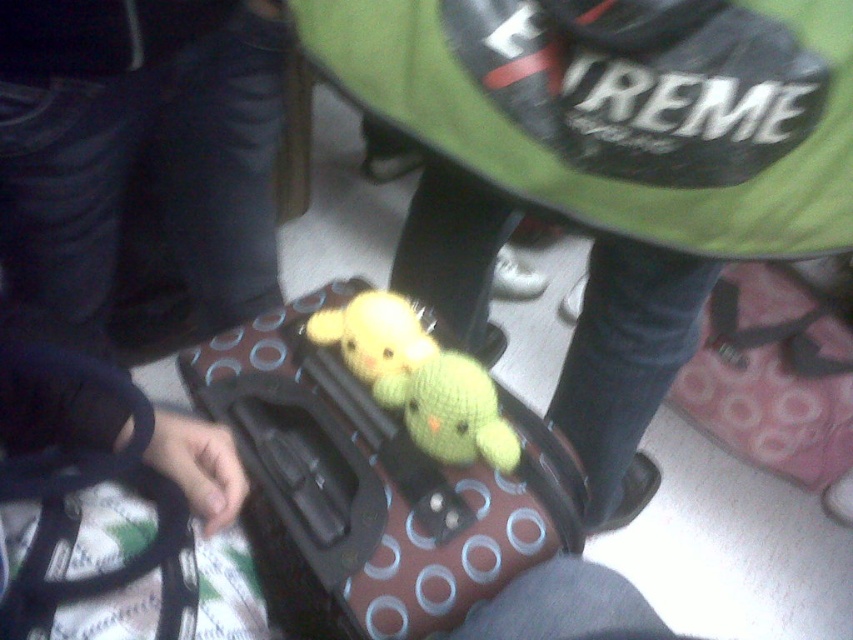
Can you confirm if brown polka dot suitcase at center is positioned to the left of yellow knitted toy at center?

Correct, you'll find brown polka dot suitcase at center to the left of yellow knitted toy at center.

Can you confirm if brown polka dot suitcase at center is positioned to the right of yellow knitted toy at center?

In fact, brown polka dot suitcase at center is to the left of yellow knitted toy at center.

Does point (289, 516) come in front of point (421, 364)?

Yes, it is in front of point (421, 364).

You are a GUI agent. You are given a task and a screenshot of the screen. Output one action in this format:
    pyautogui.click(x=<x>, y=<y>)
    Task: Click on the brown polka dot suitcase at center
    The height and width of the screenshot is (640, 853).
    Given the screenshot: What is the action you would take?
    pyautogui.click(x=370, y=488)

Is green knitted toy at center to the right of knitted yellow toy at center from the viewer's perspective?

Indeed, green knitted toy at center is positioned on the right side of knitted yellow toy at center.

Describe the element at coordinates (622, 148) in the screenshot. Image resolution: width=853 pixels, height=640 pixels. I see `green knitted toy at center` at that location.

At what (x,y) coordinates should I click in order to perform the action: click on green knitted toy at center. Please return your answer as a coordinate pair (x, y). The height and width of the screenshot is (640, 853). Looking at the image, I should click on (622, 148).

Which is behind, point (680, 140) or point (337, 332)?

Point (337, 332)

Identify the location of green knitted toy at center. This screenshot has height=640, width=853. (622, 148).

Is point (334, 74) less distant than point (305, 332)?

Yes, point (334, 74) is in front of point (305, 332).

Find the location of a particular element. The height and width of the screenshot is (640, 853). green knitted toy at center is located at coordinates (622, 148).